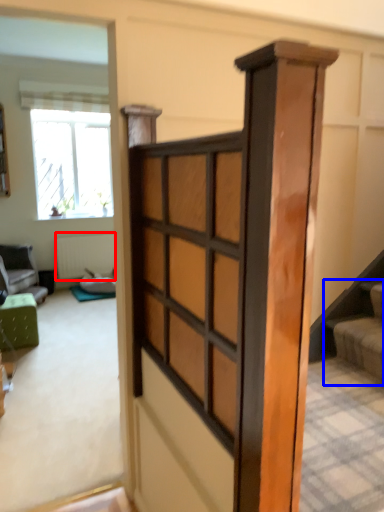
Question: Which point is closer to the camera, radiator (highlighted by a red box) or stairs (highlighted by a blue box)?

Choices:
 (A) radiator
 (B) stairs

Answer: (B)